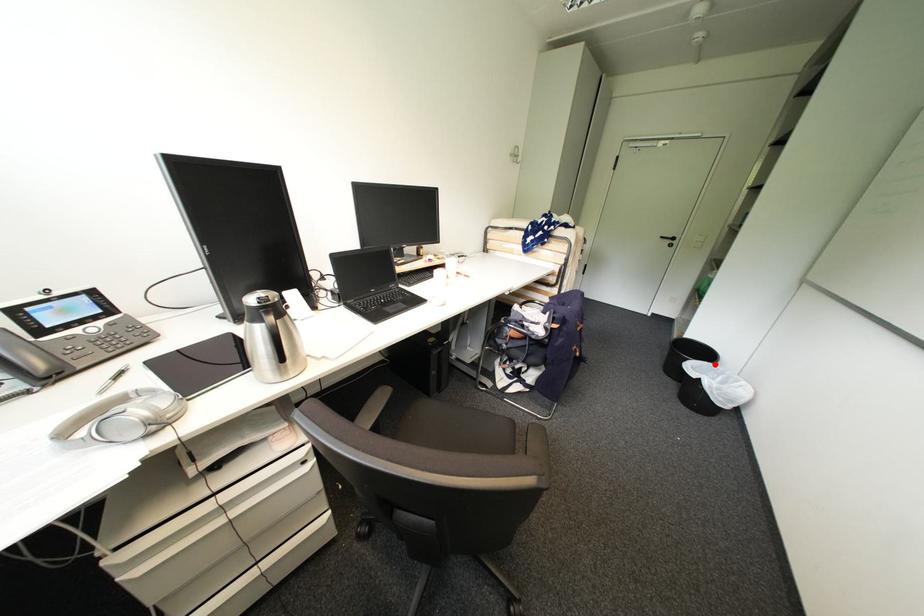
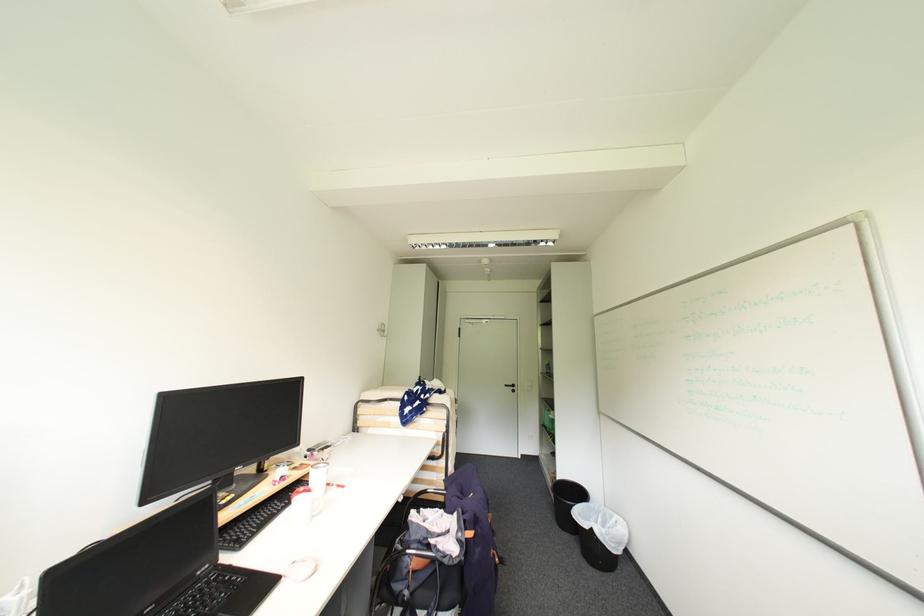
Where in the second image is the point corresponding to the highlighted location from the first image?

(591, 505)